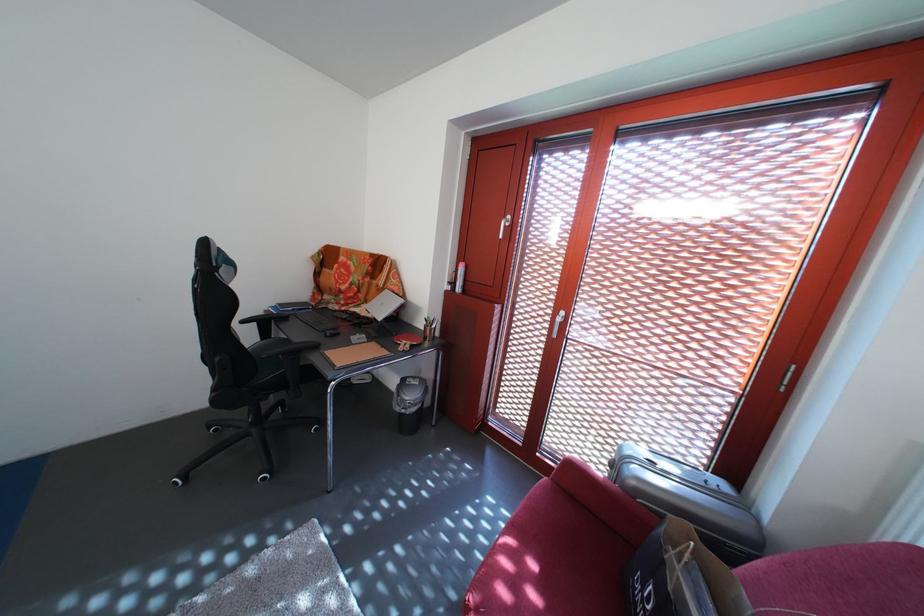
This screenshot has height=616, width=924. Identify the location of mesh trash can. (408, 403).